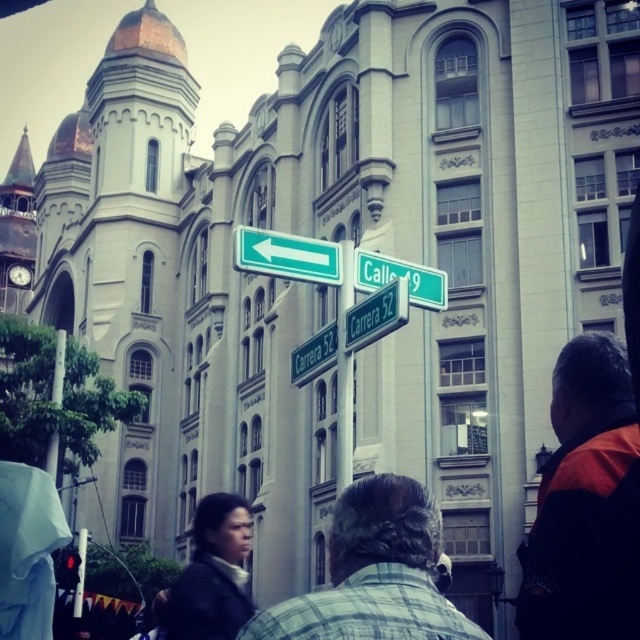
Question: Can you confirm if green plastic street sign at upper center is bigger than metallic pole at left?

Choices:
 (A) no
 (B) yes

Answer: (A)

Question: Which point is farther from the camera taking this photo?

Choices:
 (A) (353, 332)
 (B) (412, 570)

Answer: (A)

Question: Which point is closer to the camera?

Choices:
 (A) (244, 272)
 (B) (45, 460)

Answer: (A)

Question: Does dark brown leather jacket at lower left appear under green plastic street sign at center?

Choices:
 (A) no
 (B) yes

Answer: (B)

Question: Which point is farther to the camera?

Choices:
 (A) (422, 531)
 (B) (195, 595)
 (C) (333, 323)
 (D) (56, 380)

Answer: (D)

Question: Is gray plaid shirt at center to the right of green plastic street sign at center from the viewer's perspective?

Choices:
 (A) no
 (B) yes

Answer: (A)